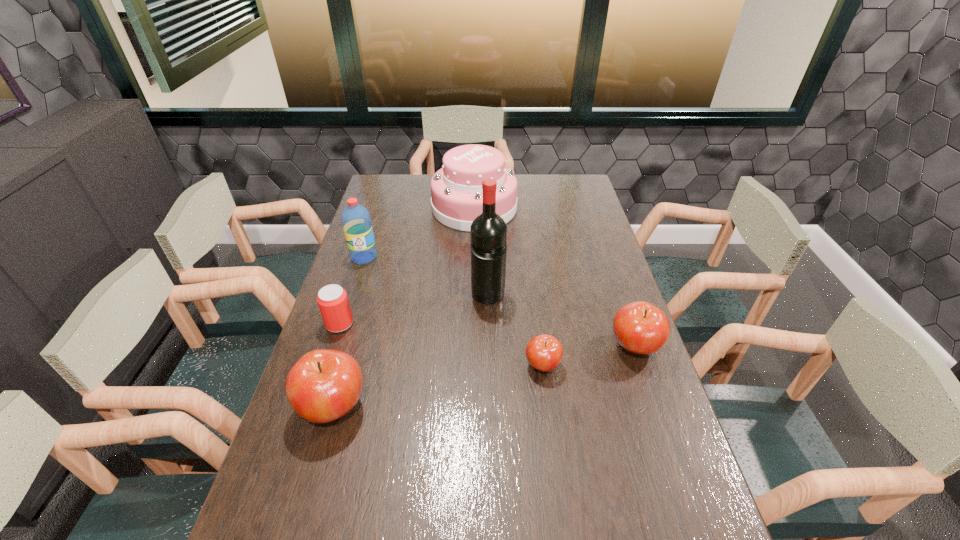
The height and width of the screenshot is (540, 960). I want to click on the leftmost apple, so click(323, 385).

The image size is (960, 540). In order to click on the shortest apple in this screenshot , I will do `click(544, 352)`.

At what (x,y) coordinates should I click in order to perform the action: click on the shortest object. Please return your answer as a coordinate pair (x, y). Looking at the image, I should click on (544, 352).

Where is `the rightmost object`? the rightmost object is located at coordinates (639, 327).

Locate an element on the screen. This screenshot has height=540, width=960. the rightmost apple is located at coordinates (639, 327).

The image size is (960, 540). Identify the location of cake. (456, 189).

Find the location of a particular element. The height and width of the screenshot is (540, 960). the second shortest object is located at coordinates (332, 300).

At what (x,y) coordinates should I click in order to perform the action: click on the sixth nearest object. Please return your answer as a coordinate pair (x, y). Looking at the image, I should click on (356, 221).

This screenshot has height=540, width=960. What are the coordinates of `wine bottle` in the screenshot? It's located at (488, 231).

The image size is (960, 540). I want to click on the fifth nearest object, so click(x=488, y=231).